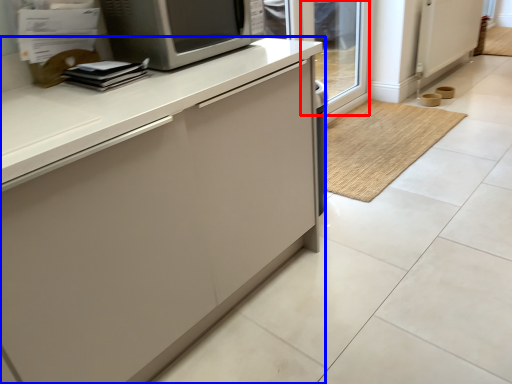
Question: Which object appears farthest to the camera in this image, glass door (highlighted by a red box) or cabinetry (highlighted by a blue box)?

Choices:
 (A) glass door
 (B) cabinetry

Answer: (A)